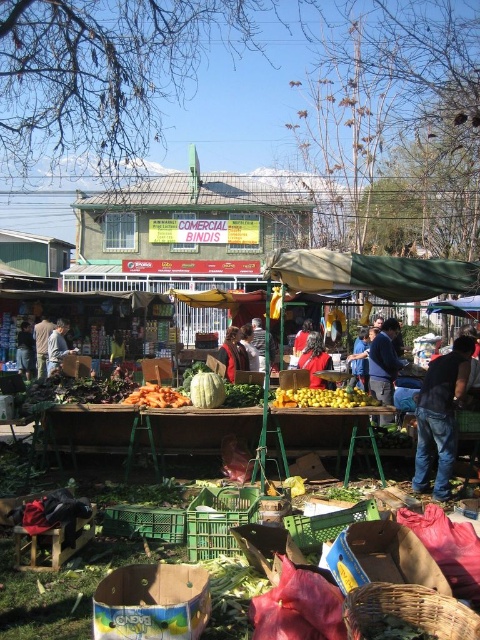
From the picture: You are standing at the entrance of the market and want to take a photo that includes both the point at coordinates (200, 403) and the point at coordinates (20, 352). Given their positions, which point will appear larger in your camera view?

Point at coordinates (200, 403) will appear larger in the camera view because it is closer to the viewer than point at coordinates (20, 352).

You are a vendor at the market and need to place both the blue denim jacket at center and the red fabric jacket at center on a shelf that can only accommodate one of them. Which jacket should you choose to fit on the shelf?

The blue denim jacket at center has a greater width than the red fabric jacket at center, so the red fabric jacket at center would fit on the shelf.